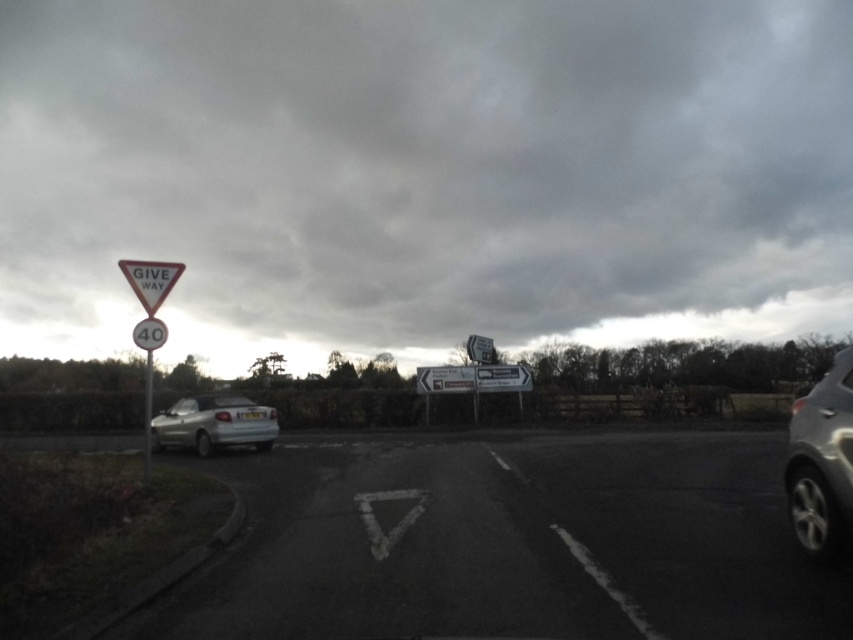
Which is behind, point (337, 566) or point (166, 330)?

Point (166, 330)

Based on the photo, who is more forward, (323, 568) or (154, 340)?

Point (323, 568) is more forward.

At what (x,y) coordinates should I click in order to perform the action: click on black asphalt parking lot at center. Please return your answer as a coordinate pair (x, y). This screenshot has height=640, width=853. Looking at the image, I should click on (508, 541).

Locate an element on the screen. The width and height of the screenshot is (853, 640). black asphalt parking lot at center is located at coordinates (508, 541).

Who is positioned more to the left, black asphalt parking lot at center or silver metallic car at right?

black asphalt parking lot at center

Does black asphalt parking lot at center have a greater height compared to silver metallic car at right?

No, black asphalt parking lot at center is not taller than silver metallic car at right.

Is point (590, 476) farther from viewer compared to point (825, 420)?

Yes, point (590, 476) is farther from viewer.

Identify the location of black asphalt parking lot at center. 508,541.

Looking at this image, is gray cloudy sky at upper center to the left of white plastic triangle at left from the viewer's perspective?

No, gray cloudy sky at upper center is not to the left of white plastic triangle at left.

Is gray cloudy sky at upper center taller than white plastic triangle at left?

Yes.

Which is in front, point (688, 228) or point (149, 356)?

Point (149, 356)

Where is `gray cloudy sky at upper center`? The image size is (853, 640). gray cloudy sky at upper center is located at coordinates (422, 173).